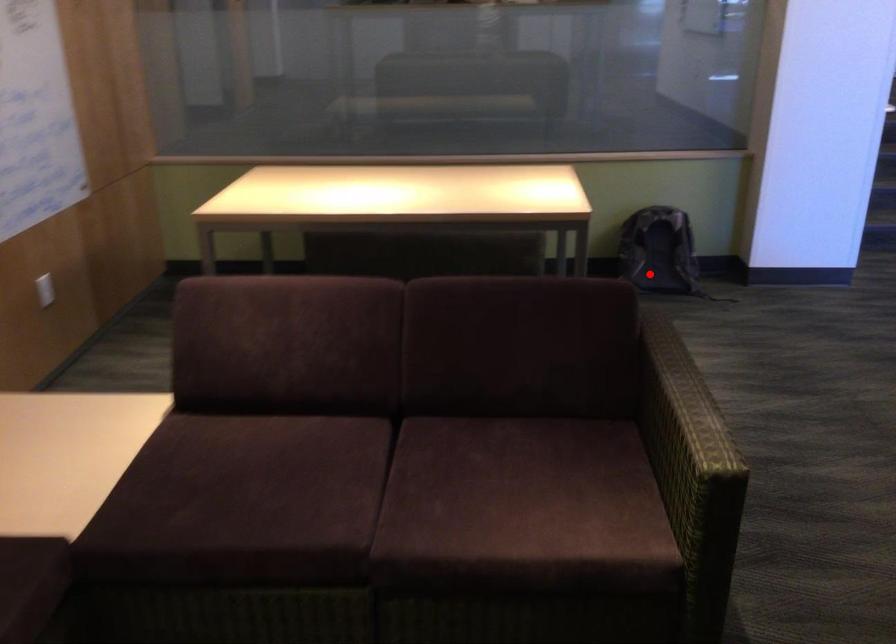
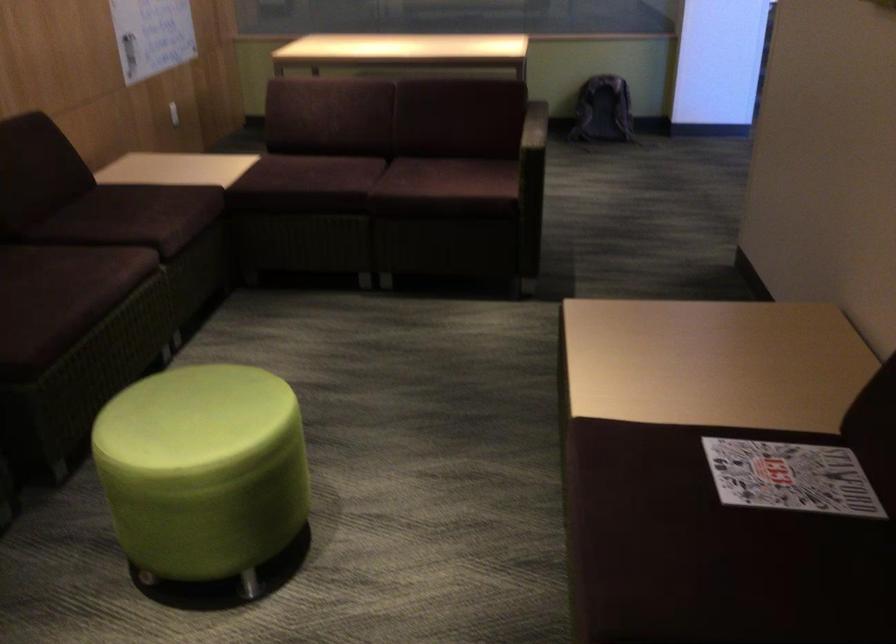
Question: I am providing you with two images of the same scene from different viewpoints. Image1 has a red point marked. In image2, the corresponding 3D location appears at what relative position? Reply with the corresponding letter.

Choices:
 (A) Closer
 (B) Farther

Answer: (B)